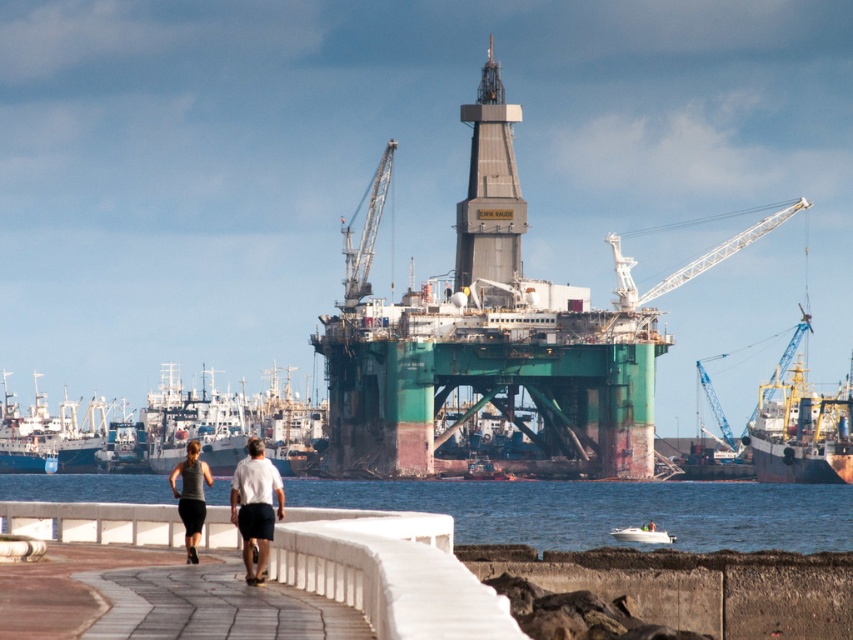
Question: Which is nearer to the white glossy boat at lower center?

Choices:
 (A) white matte shirt at center
 (B) matte black shorts at center

Answer: (B)

Question: Considering the real-world distances, which object is farthest from the white matte shirt at center?

Choices:
 (A) metallic gray crane at center
 (B) metallic gray crane at right
 (C) blue matte ship at left
 (D) white glossy boat at lower center

Answer: (C)

Question: Which of these objects is positioned closest to the gray metallic tower at center?

Choices:
 (A) white metallic crane at upper center
 (B) white matte shirt at center
 (C) metallic gray crane at right

Answer: (A)

Question: Can you confirm if paved stone walkway at lower center is bigger than white glossy boat at lower center?

Choices:
 (A) yes
 (B) no

Answer: (B)

Question: From the image, what is the correct spatial relationship of matte black shorts at center in relation to blue matte ship at left?

Choices:
 (A) below
 (B) above

Answer: (B)

Question: Does paved stone walkway at lower center have a smaller size compared to white glossy boat at lower center?

Choices:
 (A) no
 (B) yes

Answer: (B)